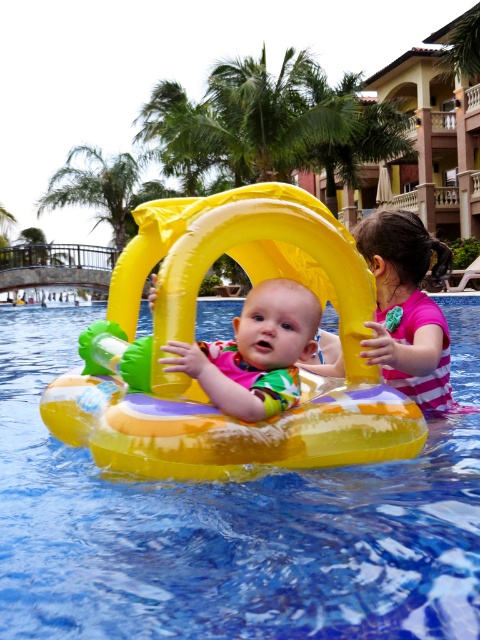
Does pink striped swimsuit at right have a lesser width compared to green leafy palm tree at upper left?

Yes.

Measure the distance between point (395,268) and camera.

They are 3.08 meters apart.

Is point (382, 292) positioned before point (64, 202)?

That is True.

Where is `pink striped swimsuit at right`? pink striped swimsuit at right is located at coordinates coord(408,308).

Which is more to the right, transparent plastic float at center or matte yellow float at center?

matte yellow float at center is more to the right.

Is point (180, 576) more distant than point (187, 346)?

No, it is in front of (187, 346).

Locate an element on the screen. Image resolution: width=480 pixels, height=640 pixels. transparent plastic float at center is located at coordinates (224, 531).

Is pink striped swimsuit at right positioned behind matte yellow float at center?

Yes, it is.

Who is higher up, pink striped swimsuit at right or matte yellow float at center?

pink striped swimsuit at right

Who is more forward, (434, 369) or (242, 349)?

Positioned in front is point (242, 349).

This screenshot has height=640, width=480. In order to click on pink striped swimsuit at right in this screenshot , I will do `click(408, 308)`.